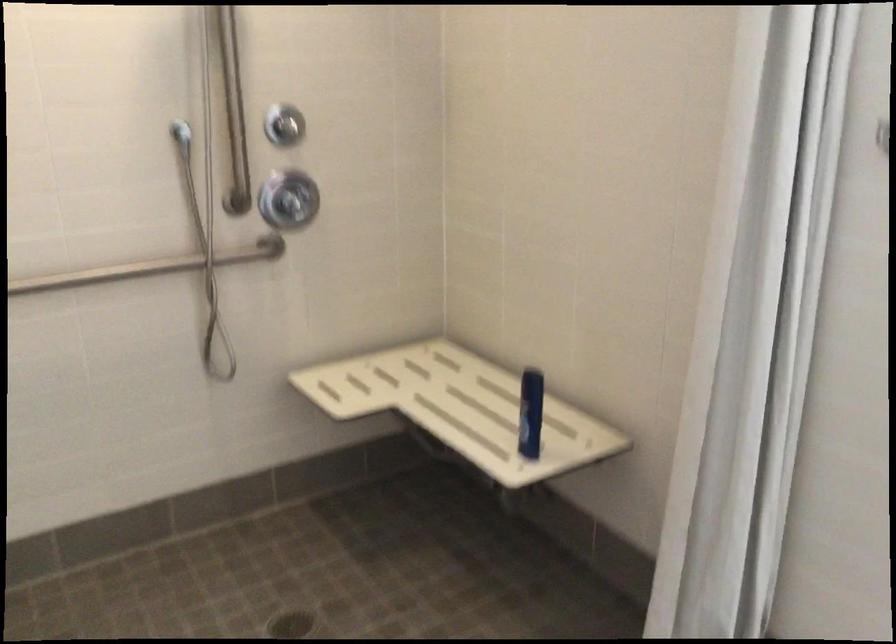
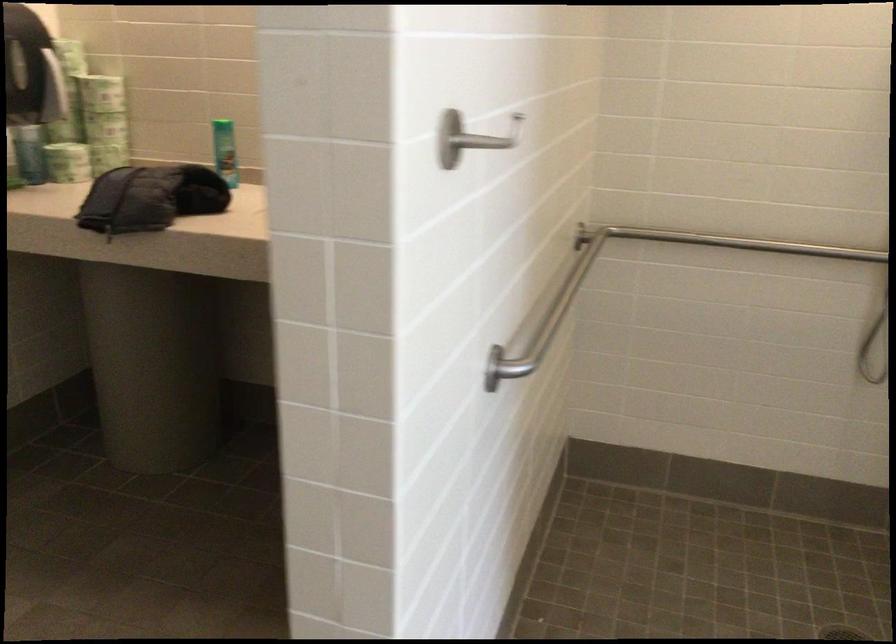
Question: The camera is either moving clockwise (left) or counter-clockwise (right) around the object. The first image is from the beginning of the video and the second image is from the end. Is the camera moving left or right when shooting the video?

Choices:
 (A) Left
 (B) Right

Answer: (B)